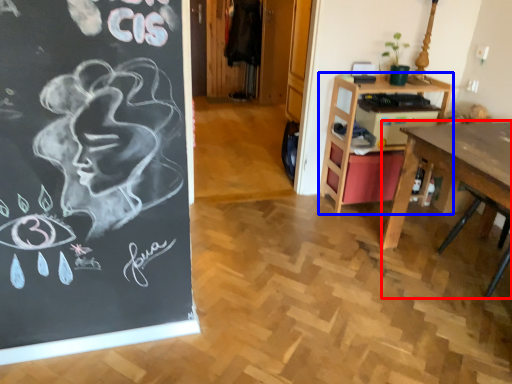
Question: Which object appears farthest to the camera in this image, desk (highlighted by a red box) or table (highlighted by a blue box)?

Choices:
 (A) desk
 (B) table

Answer: (B)